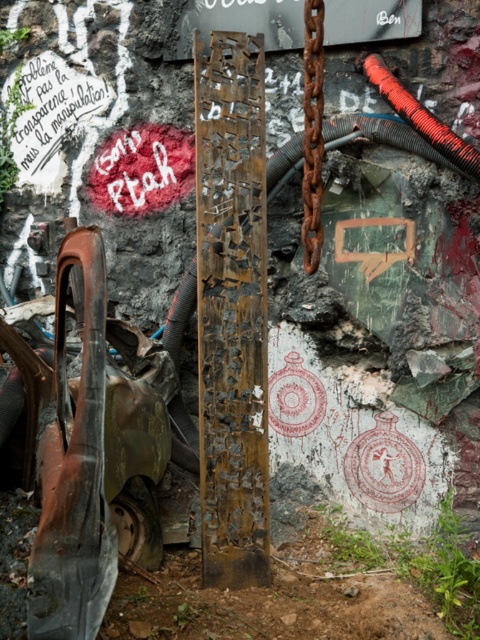
Question: From the image, what is the correct spatial relationship of rusty metal sign at upper center in relation to rusty metal chain at center?

Choices:
 (A) right
 (B) left

Answer: (B)

Question: Which point is farther from the camera taking this photo?

Choices:
 (A) (354, 13)
 (B) (315, 266)

Answer: (A)

Question: Considering the relative positions of rusty metal sign at upper center and rusty metal chain at center in the image provided, where is rusty metal sign at upper center located with respect to rusty metal chain at center?

Choices:
 (A) below
 (B) above

Answer: (B)

Question: Is rusty metal sign at upper center above rusty metal chain at center?

Choices:
 (A) yes
 (B) no

Answer: (A)

Question: Which object appears closest to the camera in this image?

Choices:
 (A) rusty metal sign at upper center
 (B) rusty metal chain at center

Answer: (B)